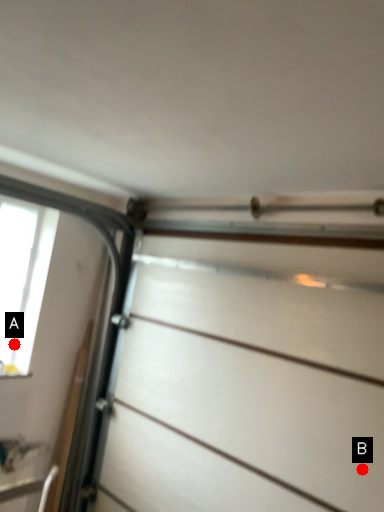
Question: Two points are circled on the image, labeled by A and B beside each circle. Which point is closer to the camera taking this photo?

Choices:
 (A) A is closer
 (B) B is closer

Answer: (B)